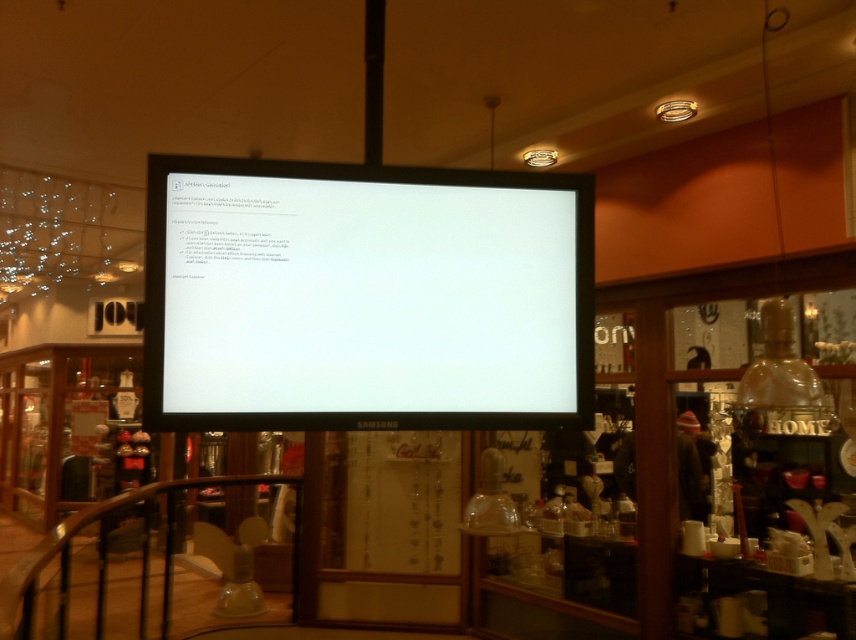
Question: Does white glossy monitor at center lie behind black metal railing at lower left?

Choices:
 (A) yes
 (B) no

Answer: (B)

Question: Does white glossy monitor at center come in front of black metal railing at lower left?

Choices:
 (A) yes
 (B) no

Answer: (A)

Question: Which point appears farthest from the camera in this image?

Choices:
 (A) click(25, 602)
 (B) click(325, 381)

Answer: (A)

Question: Does white glossy monitor at center appear under black metal railing at lower left?

Choices:
 (A) yes
 (B) no

Answer: (B)